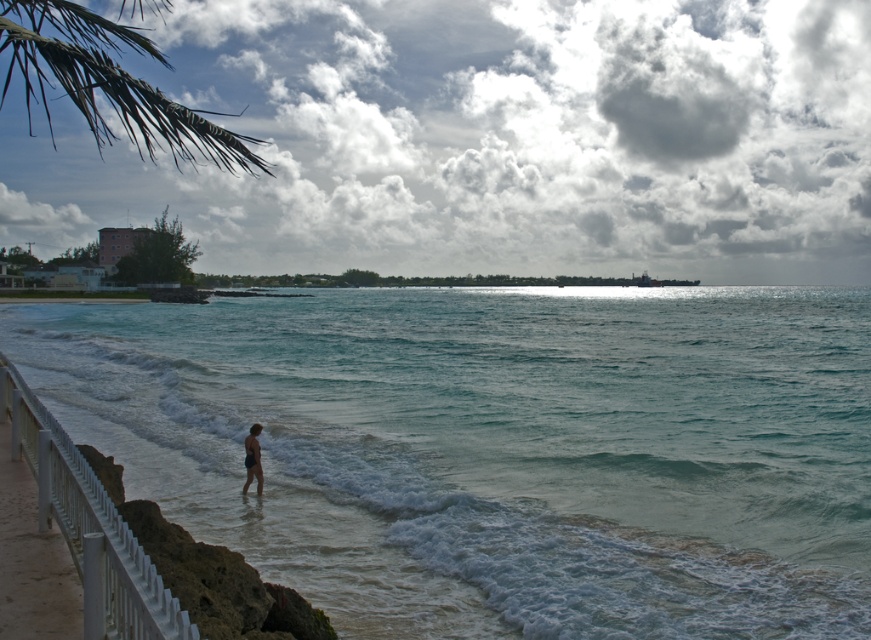
Question: Among these points, which one is nearest to the camera?

Choices:
 (A) (247, 445)
 (B) (152, 630)
 (C) (483, 604)

Answer: (B)

Question: Is white glossy rail at lower left bigger than matte black swimwear at lower center?

Choices:
 (A) yes
 (B) no

Answer: (A)

Question: Can you confirm if clear blue water at center is positioned to the right of white glossy rail at lower left?

Choices:
 (A) no
 (B) yes

Answer: (B)

Question: Is clear blue water at center closer to camera compared to white glossy rail at lower left?

Choices:
 (A) yes
 (B) no

Answer: (B)

Question: Estimate the real-world distances between objects in this image. Which object is farther from the green leafy palm at upper left?

Choices:
 (A) matte black swimwear at lower center
 (B) clear blue water at center
 (C) white glossy rail at lower left

Answer: (A)

Question: Which of the following is the closest to the observer?

Choices:
 (A) (757, 492)
 (B) (247, 444)
 (C) (166, 60)

Answer: (A)